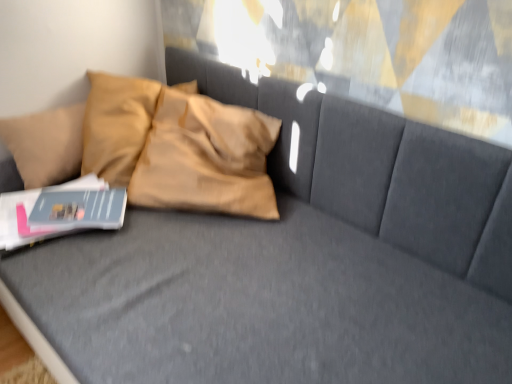
Question: Is matte gray book at lower left closer to the viewer compared to matte gray magazine at lower left?

Choices:
 (A) no
 (B) yes

Answer: (B)

Question: Is matte gray book at lower left further to the viewer compared to matte gray magazine at lower left?

Choices:
 (A) no
 (B) yes

Answer: (A)

Question: Is matte gray book at lower left at the left side of matte gray magazine at lower left?

Choices:
 (A) no
 (B) yes

Answer: (B)

Question: Can you confirm if matte gray book at lower left is shorter than matte gray magazine at lower left?

Choices:
 (A) no
 (B) yes

Answer: (A)

Question: Is matte gray book at lower left completely or partially outside of matte gray magazine at lower left?

Choices:
 (A) no
 (B) yes

Answer: (B)

Question: From a real-world perspective, is matte gray book at lower left over matte gray magazine at lower left?

Choices:
 (A) yes
 (B) no

Answer: (B)

Question: Is matte gray magazine at lower left wider than matte gray book at lower left?

Choices:
 (A) no
 (B) yes

Answer: (A)

Question: Could you tell me if matte gray magazine at lower left is turned towards matte gray book at lower left?

Choices:
 (A) no
 (B) yes

Answer: (A)

Question: Does matte gray magazine at lower left touch matte gray book at lower left?

Choices:
 (A) no
 (B) yes

Answer: (B)

Question: Are matte gray magazine at lower left and matte gray book at lower left located far from each other?

Choices:
 (A) yes
 (B) no

Answer: (B)

Question: Is matte gray magazine at lower left outside matte gray book at lower left?

Choices:
 (A) no
 (B) yes

Answer: (A)

Question: Could matte gray book at lower left be considered to be inside matte gray magazine at lower left?

Choices:
 (A) no
 (B) yes

Answer: (A)

Question: From the image's perspective, is matte gray magazine at lower left above or below matte gray book at lower left?

Choices:
 (A) below
 (B) above

Answer: (B)